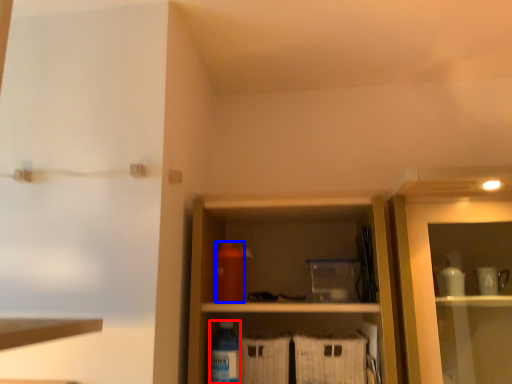
Question: Among these objects, which one is nearest to the camera, bottle (highlighted by a red box) or bottle (highlighted by a blue box)?

Choices:
 (A) bottle
 (B) bottle

Answer: (A)